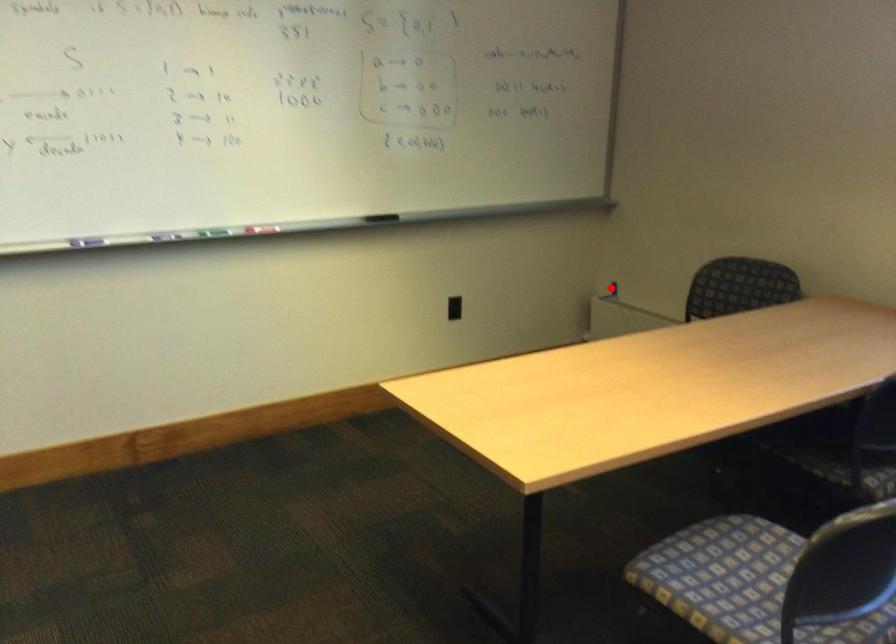
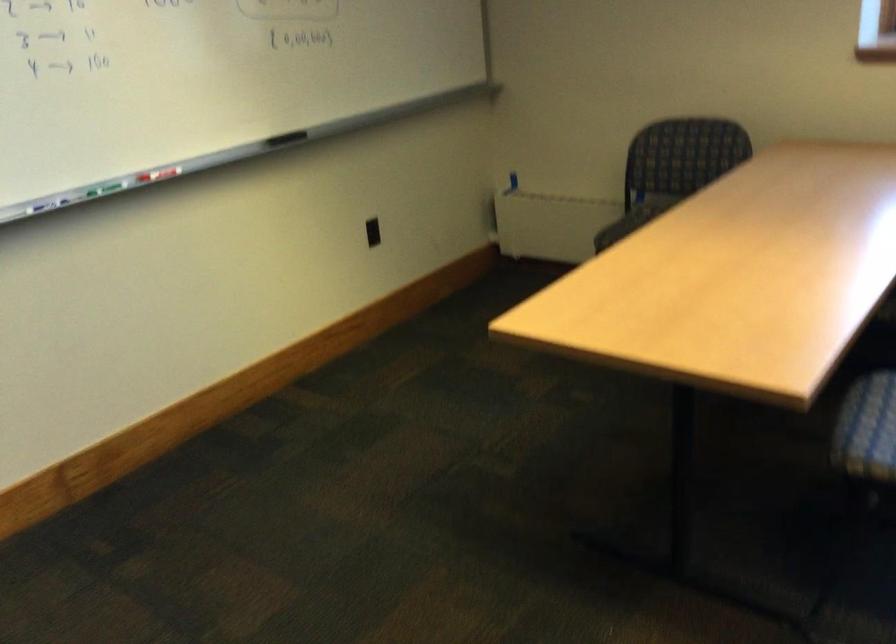
Locate, in the second image, the point that corresponds to the highlighted location in the first image.

(513, 180)